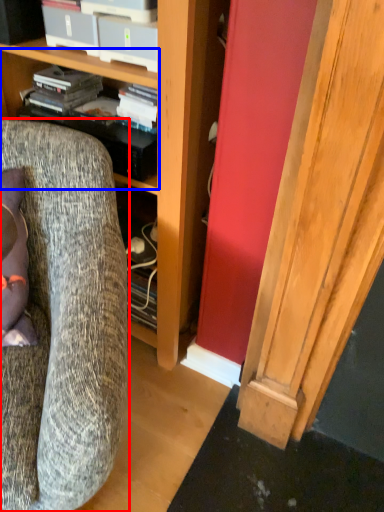
Question: Which of the following is the farthest to the observer, chair (highlighted by a red box) or shelf (highlighted by a blue box)?

Choices:
 (A) chair
 (B) shelf

Answer: (B)